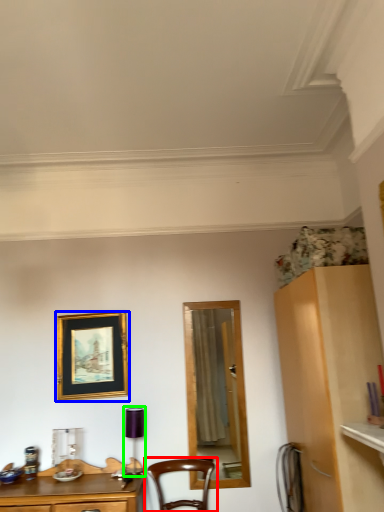
Question: Which object is positioned farthest from chair (highlighted by a red box)? Select from picture frame (highlighted by a blue box) and lamp (highlighted by a green box).

Choices:
 (A) picture frame
 (B) lamp

Answer: (A)